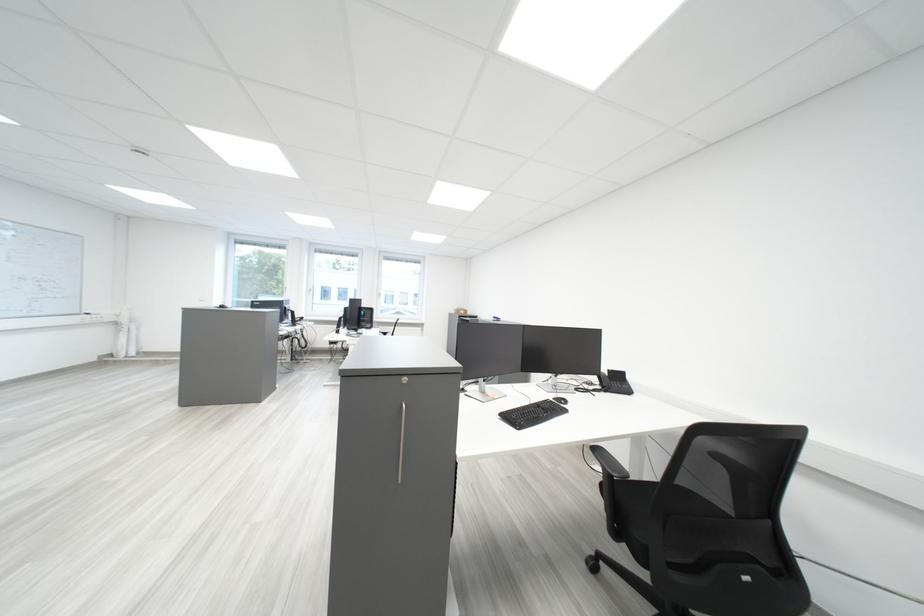
Describe the element at coordinates (647, 519) in the screenshot. I see `the chair sitting surface` at that location.